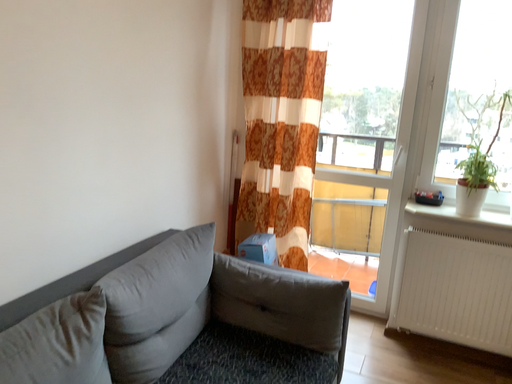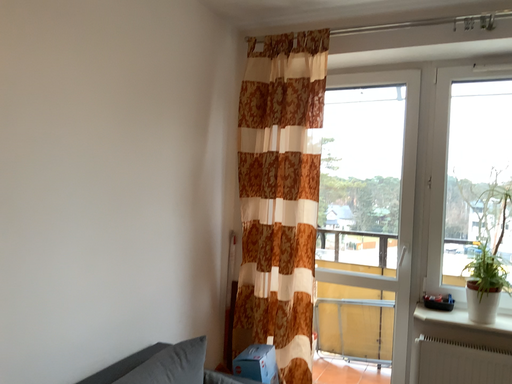
Question: Which way did the camera rotate in the video?

Choices:
 (A) rotated upward
 (B) rotated downward

Answer: (A)